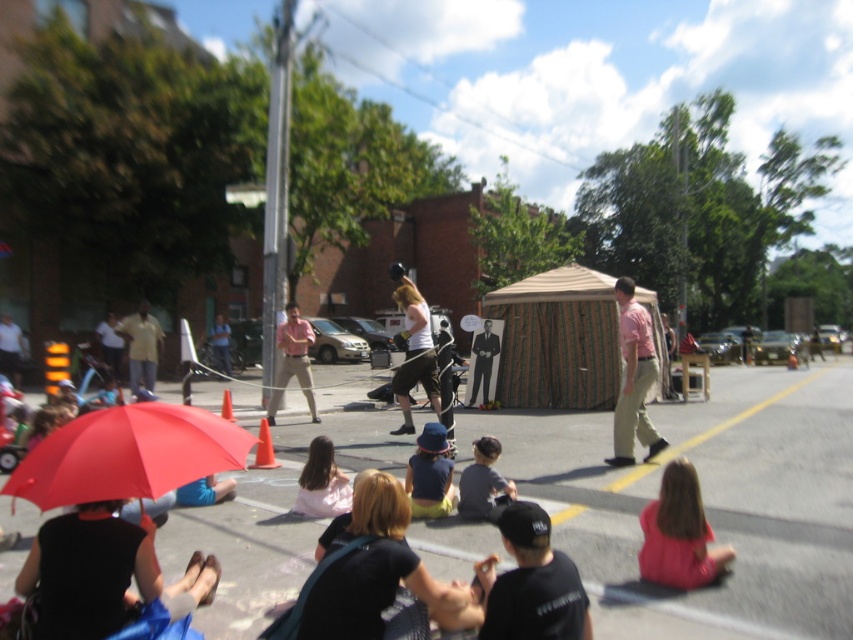
You are a performer preparing to move from the stage to the crowd. You need to walk from the orange traffic cone at center to the matte red umbrella at lower left. Is the distance between them sufficient for you to carry a 3.5 meter long banner without it dragging on the ground?

The distance between the matte red umbrella at lower left and orange traffic cone at center is 8.45 meters. Since the banner is 3.5 meters long, the space is more than enough to carry it without dragging.

You are standing at the center of the street and want to locate the matte red umbrella at lower left. According to the coordinates provided, which direction should you look to find it?

The matte red umbrella at lower left is located at point 0.711 in the x coordinate and 0.150 in the y coordinate. Since the x coordinate is 0.711, which is closer to 1, you should look to your right to find the matte red umbrella at lower left.